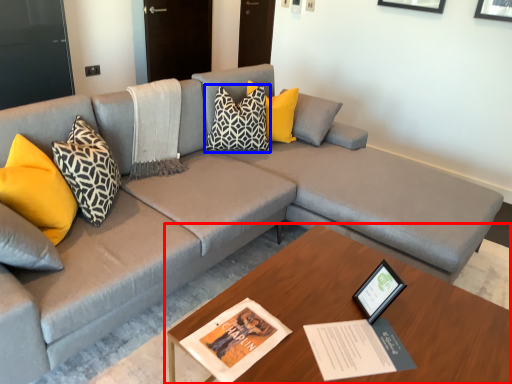
Question: Which point is further to the camera, table (highlighted by a red box) or pillow (highlighted by a blue box)?

Choices:
 (A) table
 (B) pillow

Answer: (B)